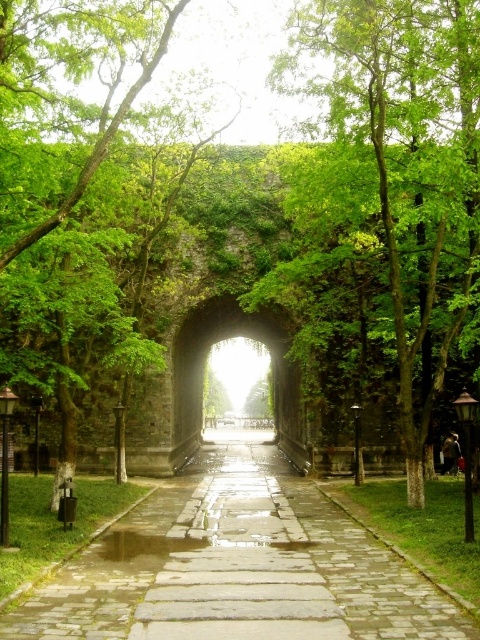
You are standing at the entrance of the pathway and want to take a photo that includes both the green leafy tree at center and the green stone archway at center. Which object will appear larger in the photo?

The green leafy tree at center will appear larger in the photo because it is taller than the green stone archway at center.

Based on the photo, you are standing at the entrance of the archway and want to walk along the paved stone path at center to reach a garden on the other side. Which side of the green leafy tree at center should you walk around to stay on the path?

The paved stone path at center is to the left of the green leafy tree at center, so you should walk around the left side of the green leafy tree at center to stay on the path.